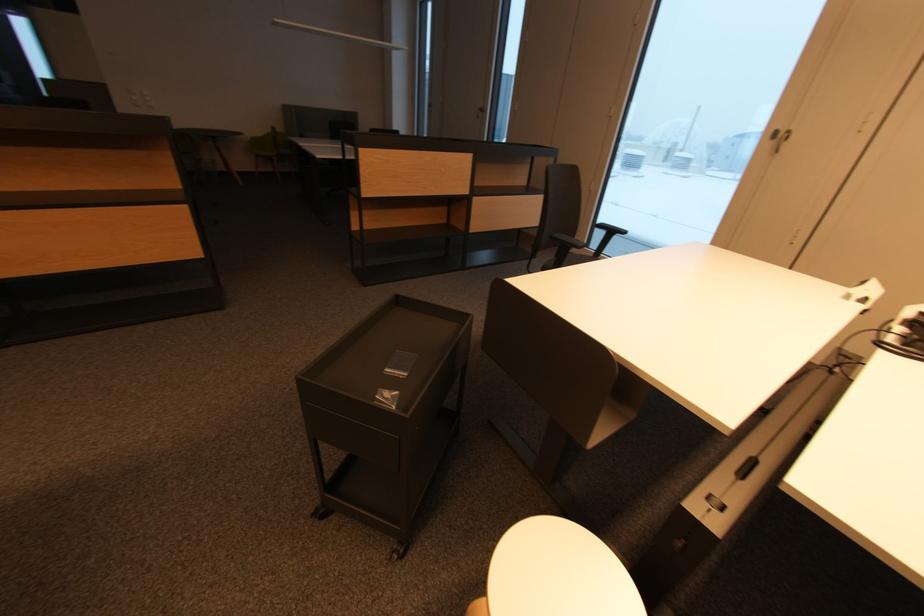
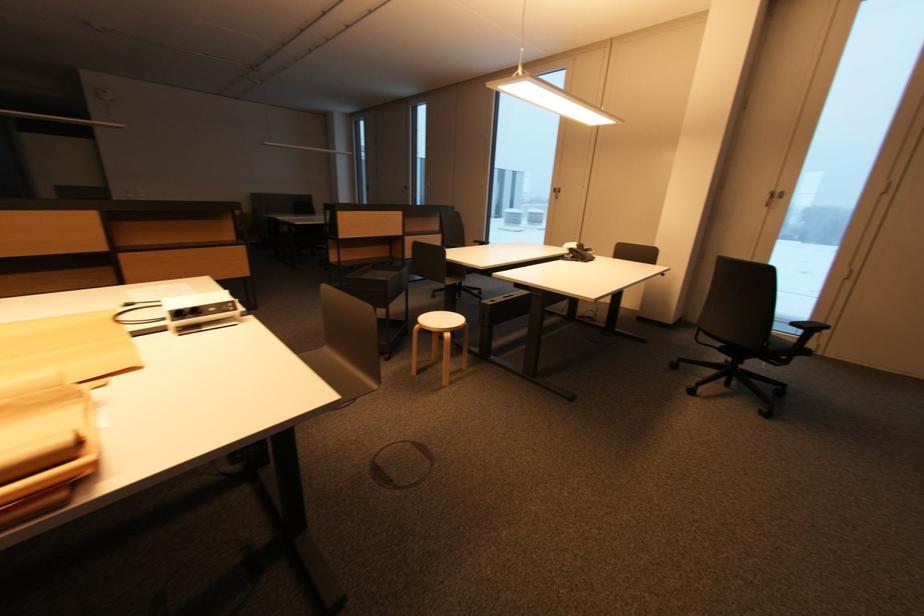
Question: The images are taken continuously from a first-person perspective. In which direction are you moving?

Choices:
 (A) Left
 (B) Right
 (C) Forward
 (D) Backward

Answer: (D)